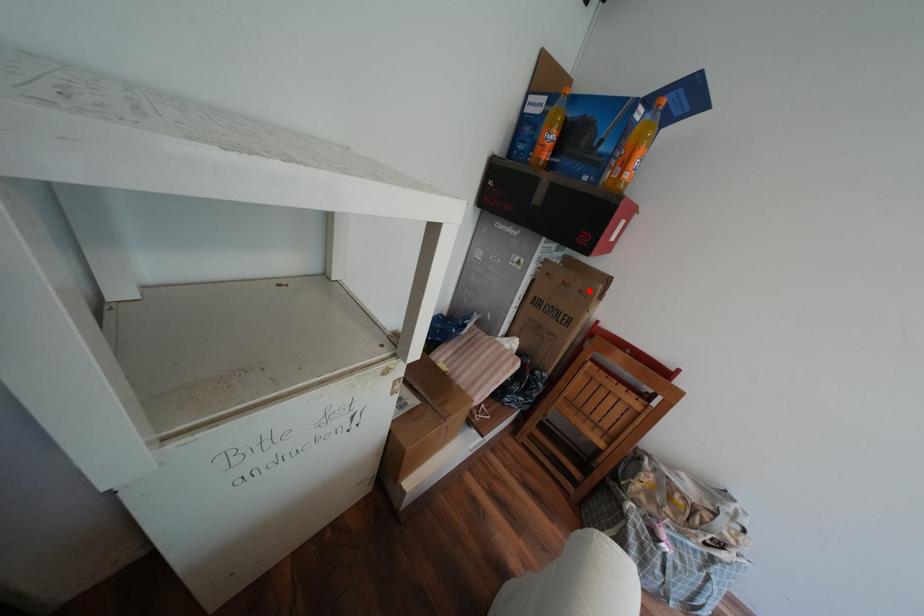
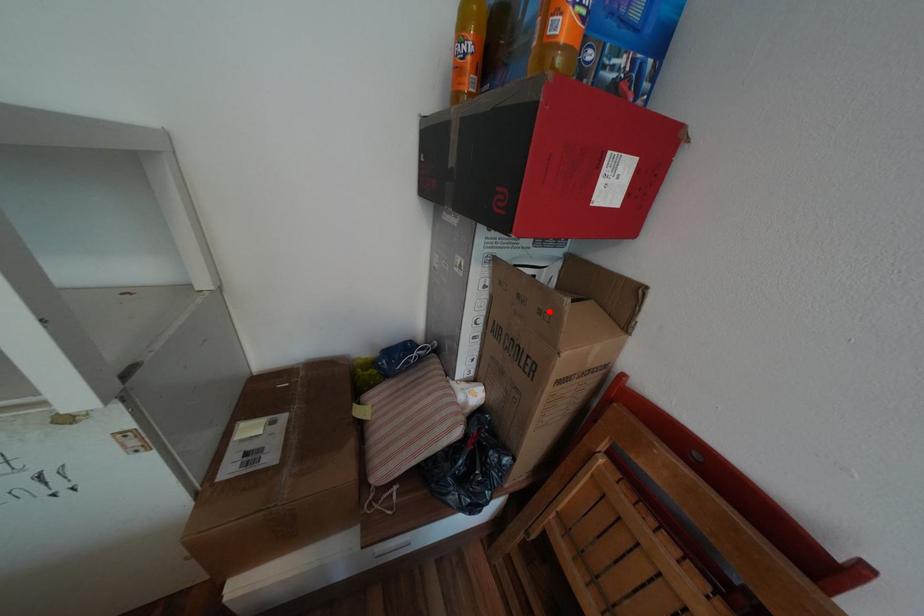
I am providing you with two images of the same scene from different viewpoints. A red point is marked on the first image and another point is marked on the second image. Do the highlighted points in image1 and image2 indicate the same real-world spot?

Yes